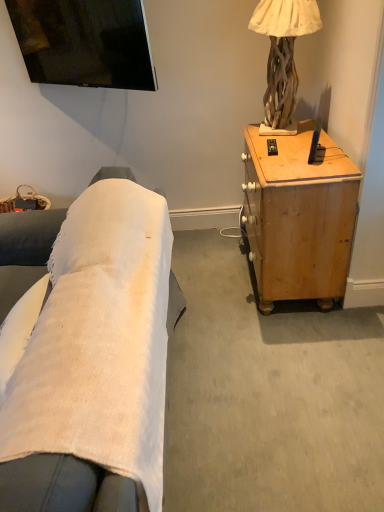
This screenshot has height=512, width=384. Describe the element at coordinates (299, 216) in the screenshot. I see `light brown wood desk at right` at that location.

Describe the element at coordinates (283, 52) in the screenshot. I see `natural wood lamp at upper right` at that location.

The height and width of the screenshot is (512, 384). What are the coordinates of `light brown wood desk at right` in the screenshot? It's located at (299, 216).

Considering the relative sizes of natural wood lamp at upper right and light brown wood desk at right in the image provided, is natural wood lamp at upper right taller than light brown wood desk at right?

In fact, natural wood lamp at upper right may be shorter than light brown wood desk at right.

Is natural wood lamp at upper right spatially inside light brown wood desk at right, or outside of it?

natural wood lamp at upper right exists outside the volume of light brown wood desk at right.

Does point (271, 82) lie in front of point (281, 140)?

That is False.

From the image's perspective, is light brown wood desk at right beneath black plastic remote control at upper right?

Yes.

This screenshot has height=512, width=384. Identify the location of remote control located behind the light brown wood desk at right. (272, 147).

Considering the positions of objects light brown wood desk at right and black plastic remote control at upper right in the image provided, who is behind, light brown wood desk at right or black plastic remote control at upper right?

black plastic remote control at upper right is more distant.

Is black plastic remote control at upper right with light brown wood desk at right?

black plastic remote control at upper right is not next to light brown wood desk at right, and they're not touching.

From the image's perspective, which one is positioned higher, black plastic remote control at upper right or light brown wood desk at right?

From the image's view, black plastic remote control at upper right is above.

Considering the relative sizes of black plastic remote control at upper right and light brown wood desk at right in the image provided, is black plastic remote control at upper right taller than light brown wood desk at right?

No, black plastic remote control at upper right is not taller than light brown wood desk at right.

Identify the location of remote control above the light brown wood desk at right (from a real-world perspective). This screenshot has height=512, width=384. (272, 147).

Which of these two, light brown wood desk at right or natural wood lamp at upper right, is bigger?

light brown wood desk at right is bigger.

Is light brown wood desk at right to the right of natural wood lamp at upper right from the viewer's perspective?

Indeed, light brown wood desk at right is positioned on the right side of natural wood lamp at upper right.

Which is less distant, (x=277, y=174) or (x=274, y=121)?

Point (x=277, y=174).

Identify the location of remote control that appears on the left of natural wood lamp at upper right. (272, 147).

Is natural wood lamp at upper right positioned beyond the bounds of black plastic remote control at upper right?

Yes.

Is natural wood lamp at upper right to the left or to the right of black plastic remote control at upper right in the image?

From the image, it's evident that natural wood lamp at upper right is to the right of black plastic remote control at upper right.

Which is behind, point (267, 101) or point (272, 154)?

The point (267, 101) is farther from the camera.

Between black plastic remote control at upper right and natural wood lamp at upper right, which one has larger width?

Wider between the two is natural wood lamp at upper right.

From a real-world perspective, which object rests below the other?

From a 3D spatial view, black plastic remote control at upper right is below.

Is natural wood lamp at upper right located within black plastic remote control at upper right?

No.

Are black plastic remote control at upper right and natural wood lamp at upper right making contact?

Result: black plastic remote control at upper right and natural wood lamp at upper right are not in contact.

Locate an element on the screen. desk below the natural wood lamp at upper right (from a real-world perspective) is located at coordinates pyautogui.click(x=299, y=216).

The image size is (384, 512). I want to click on remote control above the light brown wood desk at right (from the image's perspective), so click(272, 147).

Based on their spatial positions, is natural wood lamp at upper right or black plastic remote control at upper right closer to light brown wood desk at right?

Among the two, black plastic remote control at upper right is located nearer to light brown wood desk at right.

Which object lies nearer to the anchor point black plastic remote control at upper right, natural wood lamp at upper right or light brown wood desk at right?

natural wood lamp at upper right lies closer to black plastic remote control at upper right than the other object.

Estimate the real-world distances between objects in this image. Which object is closer to light brown wood desk at right, black plastic remote control at upper right or natural wood lamp at upper right?

The object closer to light brown wood desk at right is black plastic remote control at upper right.

From the image, which object appears to be farther from black plastic remote control at upper right, light brown wood desk at right or natural wood lamp at upper right?

The object further to black plastic remote control at upper right is light brown wood desk at right.

Considering their positions, is light brown wood desk at right positioned further to natural wood lamp at upper right than black plastic remote control at upper right?

light brown wood desk at right is positioned further to the anchor natural wood lamp at upper right.

Based on their spatial positions, is black plastic remote control at upper right or light brown wood desk at right closer to natural wood lamp at upper right?

black plastic remote control at upper right is closer to natural wood lamp at upper right.

The height and width of the screenshot is (512, 384). I want to click on remote control between natural wood lamp at upper right and light brown wood desk at right from top to bottom, so click(272, 147).